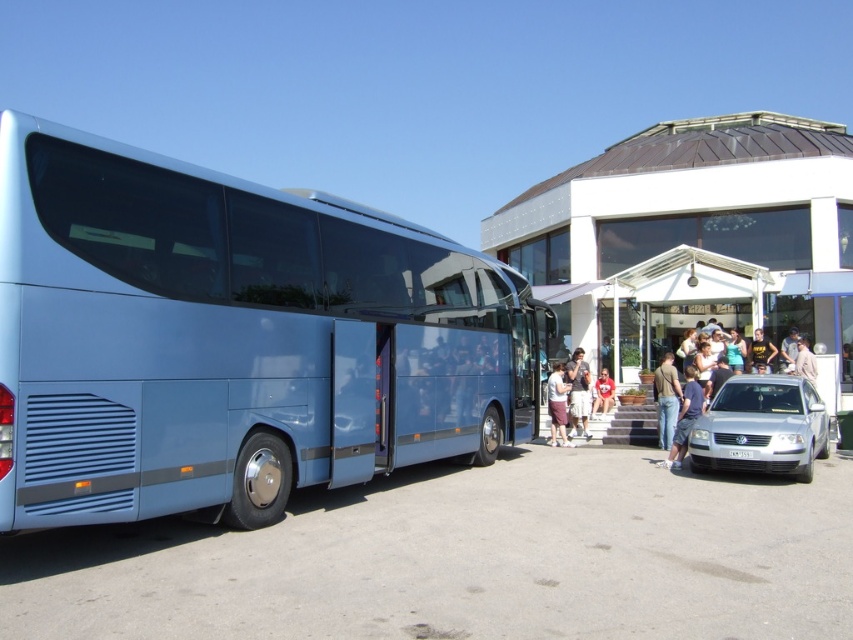
Does denim jeans at center have a greater width compared to red cotton shirt at center?

No, denim jeans at center is not wider than red cotton shirt at center.

What do you see at coordinates (666, 400) in the screenshot? I see `denim jeans at center` at bounding box center [666, 400].

Between point (680, 403) and point (604, 392), which one is positioned in front?

Point (680, 403) is in front.

Find the location of `denim jeans at center`. denim jeans at center is located at coordinates (666, 400).

Between metallic blue bus at left and red cotton shirt at center, which one has less height?

Standing shorter between the two is red cotton shirt at center.

Is point (96, 236) in front of point (602, 385)?

Yes.

I want to click on metallic blue bus at left, so click(x=233, y=339).

Does jeans at lower right appear on the right side of light brown leather jacket at lower right?

In fact, jeans at lower right is to the left of light brown leather jacket at lower right.

Who is more distant from viewer, (691, 374) or (814, 365)?

Point (814, 365)

Where is `jeans at lower right`? The image size is (853, 640). jeans at lower right is located at coordinates (683, 419).